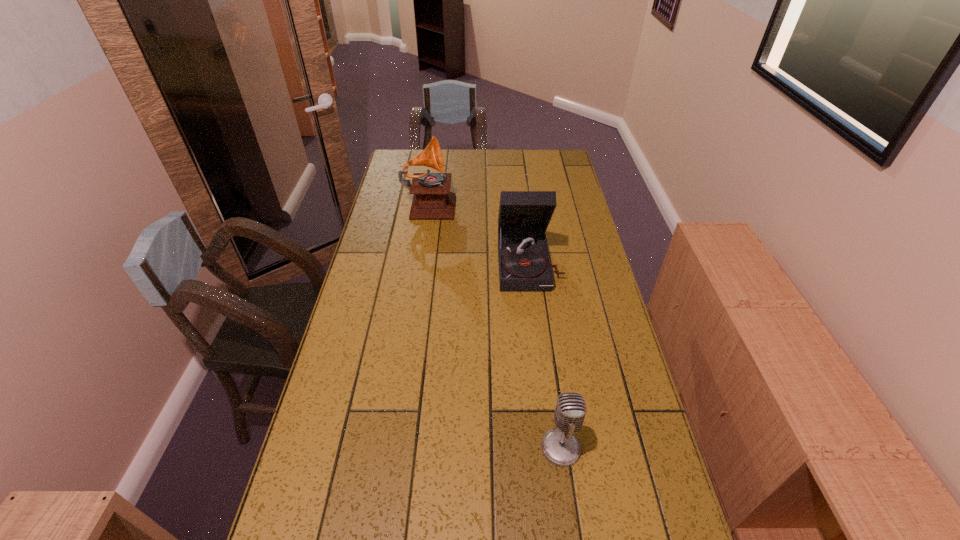
Where is `the farthest object`? The image size is (960, 540). the farthest object is located at coordinates (432, 200).

I want to click on the leftmost object, so click(432, 200).

Identify the location of the right phonograph_record. The image size is (960, 540). (524, 263).

Image resolution: width=960 pixels, height=540 pixels. I want to click on the second farthest object, so click(524, 263).

I want to click on the shortest object, so click(x=560, y=446).

Where is `microphone`? The height and width of the screenshot is (540, 960). microphone is located at coordinates (560, 446).

You are a GUI agent. You are given a task and a screenshot of the screen. Output one action in this format:
    pyautogui.click(x=<x>, y=<y>)
    Task: Click on the free space located on the horn of the farther phonograph_record
    
    Given the screenshot: What is the action you would take?
    pyautogui.click(x=520, y=202)

This screenshot has width=960, height=540. I want to click on free region located 0.090m on the front-facing side of the second nearest object, so click(536, 312).

You are a GUI agent. You are given a task and a screenshot of the screen. Output one action in this format:
    pyautogui.click(x=<x>, y=<y>)
    Task: Click on the free space located 0.310m on the back of the microphone
    This screenshot has height=540, width=960.
    Given the screenshot: What is the action you would take?
    pyautogui.click(x=545, y=333)

Find the location of `object located at the left edge`. object located at the left edge is located at coordinates (432, 200).